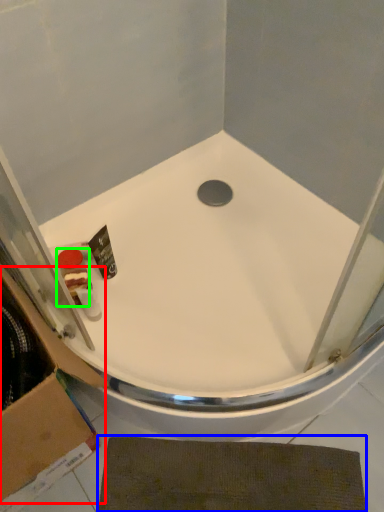
Question: Considering the real-world distances, which object is closest to cardboard box (highlighted by a red box)? bath mat (highlighted by a blue box) or toiletry (highlighted by a green box).

Choices:
 (A) bath mat
 (B) toiletry

Answer: (A)